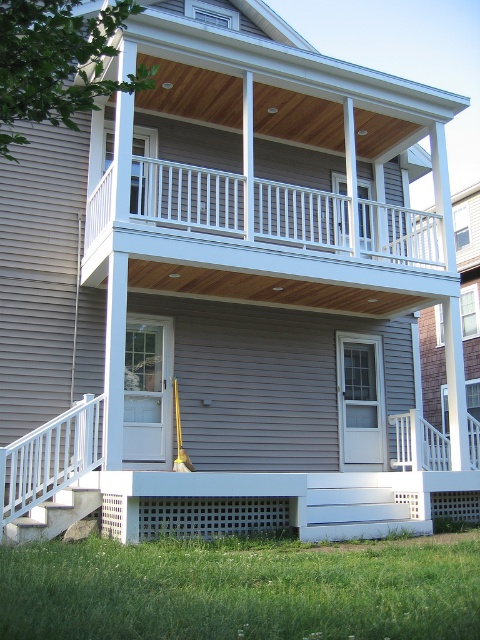
Question: Is white matte railing at lower left below white painted wood stairs at lower left?

Choices:
 (A) yes
 (B) no

Answer: (B)

Question: Which of the following is the closest to the observer?

Choices:
 (A) (19, 444)
 (B) (60, 502)

Answer: (A)

Question: Does white matte railing at lower left appear on the left side of white painted wood stairs at lower left?

Choices:
 (A) no
 (B) yes

Answer: (B)

Question: Which object appears closest to the camera in this image?

Choices:
 (A) white painted wood stairs at lower left
 (B) white matte railing at lower left

Answer: (B)

Question: Observing the image, what is the correct spatial positioning of white matte railing at lower left in reference to white painted wood stairs at lower left?

Choices:
 (A) below
 (B) above

Answer: (B)

Question: Among these objects, which one is nearest to the camera?

Choices:
 (A) white painted wood stairs at lower left
 (B) white matte railing at lower left

Answer: (B)